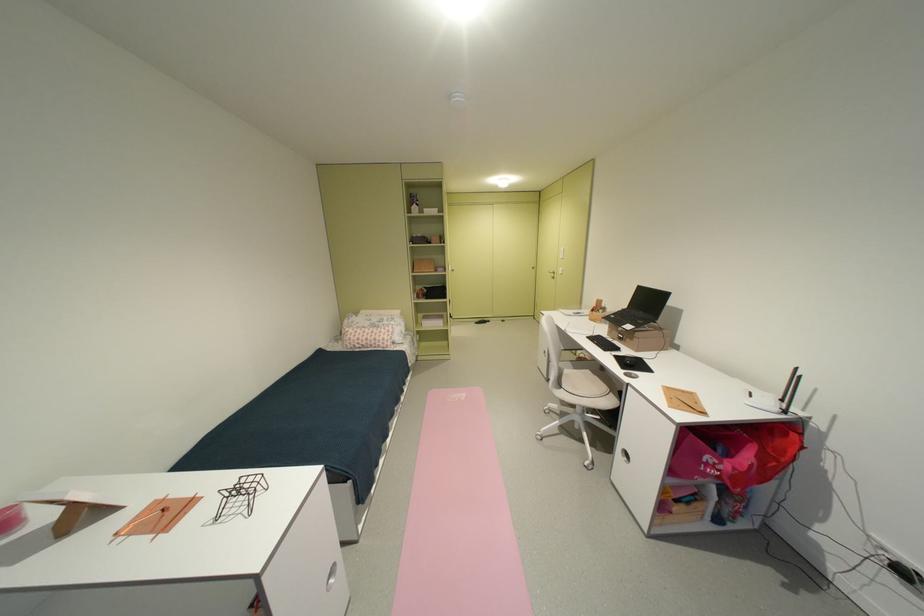
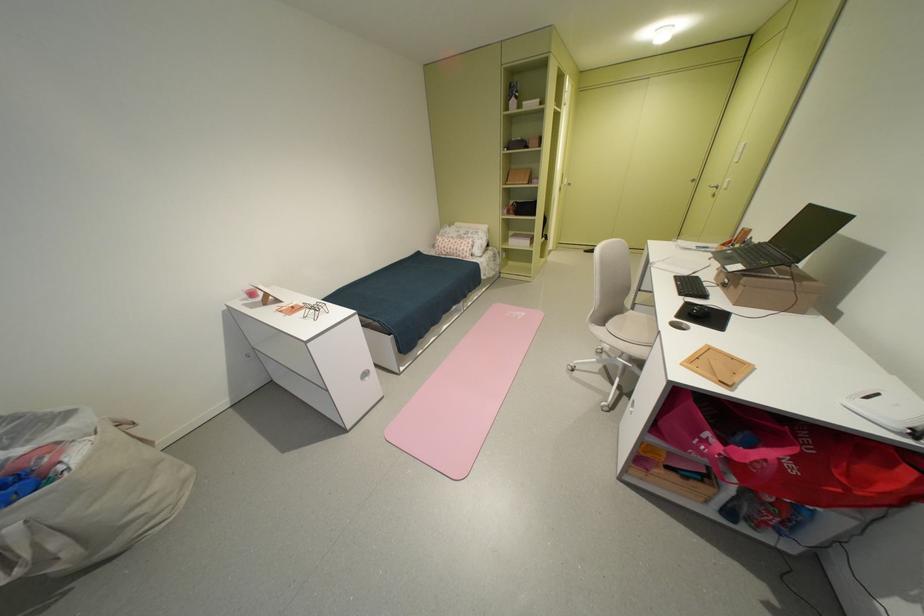
Where in the second image is the point corresponding to point (641, 341) from the first image?

(746, 288)